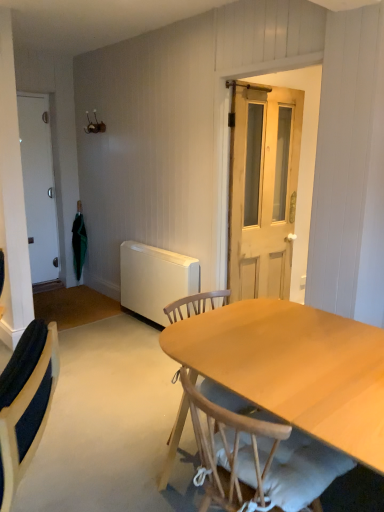
In order to face green fabric umbrella at left, should I rotate leftwards or rightwards?

Rotate left and turn 15.031 degrees.

The width and height of the screenshot is (384, 512). Describe the element at coordinates (38, 186) in the screenshot. I see `white matte door at left, positioned as the 2th door in right-to-left order` at that location.

In order to face light brown wooden door at center, the second door in the back-to-front sequence, should I rotate leftwards or rightwards?

It's best to rotate right around 10.197 degrees.

What do you see at coordinates (26, 403) in the screenshot?
I see `velvet blue chair at lower left, marked as the first chair in a left-to-right arrangement` at bounding box center [26, 403].

The height and width of the screenshot is (512, 384). Describe the element at coordinates (155, 279) in the screenshot. I see `white matte radiator at lower left` at that location.

Locate an element on the screen. green fabric umbrella at left is located at coordinates (79, 241).

From the image's perspective, is wooden chair at center, which is the second chair from left to right, located above velvet blue chair at lower left, marked as the first chair in a left-to-right arrangement?

Actually, wooden chair at center, which is the second chair from left to right, appears below velvet blue chair at lower left, marked as the first chair in a left-to-right arrangement, in the image.

Is wooden chair at center, which is the second chair from left to right, bigger or smaller than velvet blue chair at lower left, marked as the first chair in a left-to-right arrangement?

Clearly, wooden chair at center, which is the second chair from left to right, is larger in size than velvet blue chair at lower left, marked as the first chair in a left-to-right arrangement.

From a real-world perspective, who is located higher, wooden chair at center, which is the second chair from left to right, or velvet blue chair at lower left, positioned as the 2th chair in right-to-left order?

In real-world perspective, velvet blue chair at lower left, positioned as the 2th chair in right-to-left order, is above.

In the image, is wooden chair at center, which is the 1th chair in right-to-left order, positioned in front of or behind velvet blue chair at lower left, marked as the first chair in a left-to-right arrangement?

Clearly, wooden chair at center, which is the 1th chair in right-to-left order, is behind velvet blue chair at lower left, marked as the first chair in a left-to-right arrangement.

In the scene shown: Which of these two, green fabric umbrella at left or wooden chair at center, which is the 1th chair in right-to-left order, stands taller?

green fabric umbrella at left.

Is green fabric umbrella at left at the left side of wooden chair at center, which is the 1th chair in right-to-left order?

Indeed, green fabric umbrella at left is positioned on the left side of wooden chair at center, which is the 1th chair in right-to-left order.

Identify the location of umbrella that is behind the wooden chair at center, which is the second chair from left to right. (79, 241).

From the image's perspective, is green fabric umbrella at left located beneath wooden chair at center, which is the second chair from left to right?

No, from the image's perspective, green fabric umbrella at left is not below wooden chair at center, which is the second chair from left to right.

Considering the relative sizes of light brown wooden door at center, placed as the 2th door when sorted from left to right, and wooden chair at center, which is the 1th chair in right-to-left order, in the image provided, is light brown wooden door at center, placed as the 2th door when sorted from left to right, thinner than wooden chair at center, which is the 1th chair in right-to-left order,?

Indeed, light brown wooden door at center, placed as the 2th door when sorted from left to right, has a lesser width compared to wooden chair at center, which is the 1th chair in right-to-left order.

From a real-world perspective, is light brown wooden door at center, which is counted as the 1th door, starting from the front, on wooden chair at center, which is the 1th chair in right-to-left order?

Yes, from a real-world perspective, light brown wooden door at center, which is counted as the 1th door, starting from the front, is over wooden chair at center, which is the 1th chair in right-to-left order

Which is in front, light brown wooden door at center, which is counted as the 1th door, starting from the front, or wooden chair at center, which is the 1th chair in right-to-left order?

wooden chair at center, which is the 1th chair in right-to-left order, is closer to the camera.

Would you say wooden chair at center, which is the second chair from left to right, is inside or outside white matte door at left, acting as the 1th door starting from the back?

The correct answer is: outside.

Considering the sizes of objects wooden chair at center, which is the second chair from left to right, and white matte door at left, the second door viewed from the front, in the image provided, who is thinner, wooden chair at center, which is the second chair from left to right, or white matte door at left, the second door viewed from the front,?

Thinner between the two is white matte door at left, the second door viewed from the front.

Are wooden chair at center, which is the 1th chair in right-to-left order, and white matte door at left, positioned as the 2th door in right-to-left order, beside each other?

No, wooden chair at center, which is the 1th chair in right-to-left order, is not next to white matte door at left, positioned as the 2th door in right-to-left order.

Is wooden chair at center, which is the second chair from left to right, positioned with its back to white matte door at left, the second door viewed from the front?

No, wooden chair at center, which is the second chair from left to right,'s orientation is not away from white matte door at left, the second door viewed from the front.

From a real-world perspective, between wooden chair at center, which is the 1th chair in right-to-left order, and white matte radiator at lower left, who is vertically lower?

white matte radiator at lower left is physically lower.

Can you see wooden chair at center, which is the second chair from left to right, touching white matte radiator at lower left?

There is a gap between wooden chair at center, which is the second chair from left to right, and white matte radiator at lower left.

Which of these two, wooden chair at center, which is the second chair from left to right, or white matte radiator at lower left, is bigger?

wooden chair at center, which is the second chair from left to right, is bigger.

Is wooden chair at center, which is the second chair from left to right, aimed at white matte radiator at lower left?

No, wooden chair at center, which is the second chair from left to right, is not oriented towards white matte radiator at lower left.

From the image's perspective, which object appears higher, white fabric tablecloth at center or white matte radiator at lower left?

white matte radiator at lower left, from the image's perspective.

Considering the relative positions of white fabric tablecloth at center and white matte radiator at lower left in the image provided, is white fabric tablecloth at center behind white matte radiator at lower left?

No, the depth of white fabric tablecloth at center is less than that of white matte radiator at lower left.

How many degrees apart are the facing directions of white fabric tablecloth at center and white matte radiator at lower left?

They differ by 91.3 degrees in their facing directions.

Between white fabric tablecloth at center and white matte radiator at lower left, which one appears on the left side from the viewer's perspective?

Positioned to the left is white matte radiator at lower left.

Considering the sizes of objects light brown wooden door at center, placed as the 2th door when sorted from left to right, and velvet blue chair at lower left, marked as the first chair in a left-to-right arrangement, in the image provided, who is taller, light brown wooden door at center, placed as the 2th door when sorted from left to right, or velvet blue chair at lower left, marked as the first chair in a left-to-right arrangement,?

light brown wooden door at center, placed as the 2th door when sorted from left to right.

There is a light brown wooden door at center, which ranks as the first door in right-to-left order. At what (x,y) coordinates should I click in order to perform the action: click on the 1st chair below it (from the image's perspective). Please return your answer as a coordinate pair (x, y). The height and width of the screenshot is (512, 384). Looking at the image, I should click on (26, 403).

Based on the photo, are light brown wooden door at center, which is counted as the 1th door, starting from the front, and velvet blue chair at lower left, marked as the first chair in a left-to-right arrangement, beside each other?

No, light brown wooden door at center, which is counted as the 1th door, starting from the front, is not in contact with velvet blue chair at lower left, marked as the first chair in a left-to-right arrangement.

Which is closer, (280, 224) or (13, 426)?

Positioned in front is point (13, 426).

Locate an element on the screen. chair in front of the wooden chair at center, which is the second chair from left to right is located at coordinates click(x=26, y=403).

At what (x,y) coordinates should I click in order to perform the action: click on chair directly beneath the green fabric umbrella at left (from a real-world perspective). Please return your answer as a coordinate pair (x, y). Looking at the image, I should click on click(x=257, y=453).

Estimate the real-world distances between objects in this image. Which object is closer to white fabric tablecloth at center, light brown wooden door at center, which is counted as the 1th door, starting from the front, or wooden chair at center, which is the 1th chair in right-to-left order?

Among the two, wooden chair at center, which is the 1th chair in right-to-left order, is located nearer to white fabric tablecloth at center.

Looking at this image, from the image, which object appears to be farther from wooden chair at center, which is the 1th chair in right-to-left order, green fabric umbrella at left or velvet blue chair at lower left, marked as the first chair in a left-to-right arrangement?

green fabric umbrella at left is positioned further to the anchor wooden chair at center, which is the 1th chair in right-to-left order.

Which object lies further to the anchor point white matte door at left, positioned as the 2th door in right-to-left order, white matte radiator at lower left or wooden chair at center, which is the second chair from left to right?

wooden chair at center, which is the second chair from left to right.

From the image, which object appears to be nearer to velvet blue chair at lower left, positioned as the 2th chair in right-to-left order, light brown wooden door at center, which ranks as the first door in right-to-left order, or wooden chair at center, which is the second chair from left to right?

wooden chair at center, which is the second chair from left to right.

When comparing their distances from green fabric umbrella at left, does white matte door at left, the second door viewed from the front, or white fabric tablecloth at center seem closer?

Based on the image, white matte door at left, the second door viewed from the front, appears to be nearer to green fabric umbrella at left.

Which object lies further to the anchor point green fabric umbrella at left, white matte radiator at lower left or light brown wooden door at center, placed as the 2th door when sorted from left to right?

Among the two, light brown wooden door at center, placed as the 2th door when sorted from left to right, is located further to green fabric umbrella at left.

From the image, which object appears to be nearer to white fabric tablecloth at center, white matte door at left, positioned as the 2th door in right-to-left order, or light brown wooden door at center, which is counted as the 1th door, starting from the front?

light brown wooden door at center, which is counted as the 1th door, starting from the front, is positioned closer to the anchor white fabric tablecloth at center.

When comparing their distances from white fabric tablecloth at center, does velvet blue chair at lower left, marked as the first chair in a left-to-right arrangement, or white matte door at left, positioned as the 2th door in right-to-left order, seem closer?

The object closer to white fabric tablecloth at center is velvet blue chair at lower left, marked as the first chair in a left-to-right arrangement.

Where is `radiator between white fabric tablecloth at center and green fabric umbrella at left along the z-axis`? radiator between white fabric tablecloth at center and green fabric umbrella at left along the z-axis is located at coordinates (155, 279).

Identify the location of door located between wooden chair at center, which is the 1th chair in right-to-left order, and white matte radiator at lower left in the depth direction. (263, 189).

You are a GUI agent. You are given a task and a screenshot of the screen. Output one action in this format:
    pyautogui.click(x=<x>, y=<y>)
    Task: Click on the door between velvet blue chair at lower left, marked as the first chair in a left-to-right arrangement, and white matte door at left, positioned as the 2th door in right-to-left order, in the front-back direction
    The width and height of the screenshot is (384, 512).
    Given the screenshot: What is the action you would take?
    pyautogui.click(x=263, y=189)

At what (x,y) coordinates should I click in order to perform the action: click on radiator between wooden chair at center, which is the second chair from left to right, and green fabric umbrella at left from front to back. Please return your answer as a coordinate pair (x, y). Looking at the image, I should click on (155, 279).